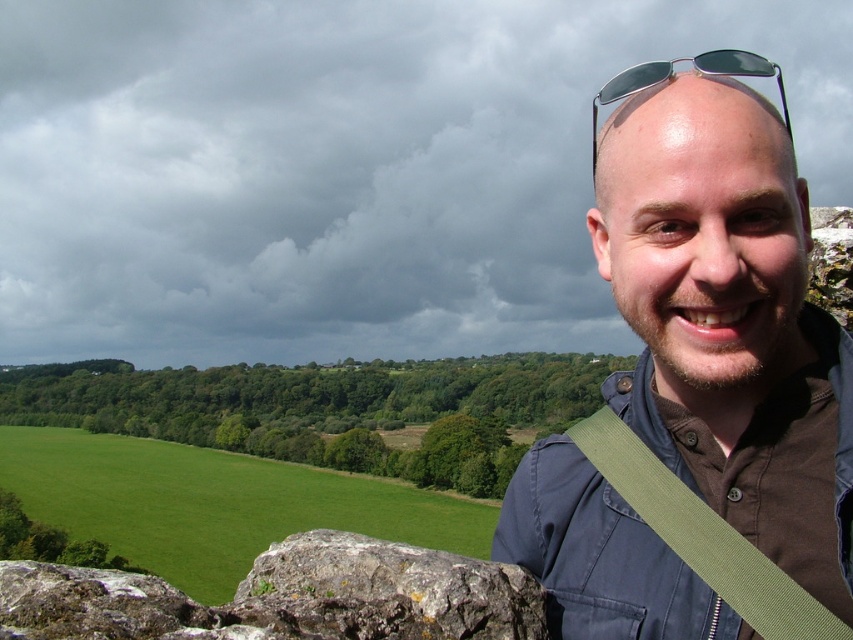
Consider the image. Is brown fabric shirt at upper right shorter than rough textured stone at lower left?

No.

Between brown fabric shirt at upper right and rough textured stone at lower left, which one appears on the left side from the viewer's perspective?

Positioned to the left is rough textured stone at lower left.

This screenshot has height=640, width=853. I want to click on brown fabric shirt at upper right, so click(699, 387).

Is point (613, 88) farther from camera compared to point (763, 61)?

Yes, it is behind point (763, 61).

Is brown fabric shirt at upper right shorter than sunglasses at upper center?

Yes, brown fabric shirt at upper right is shorter than sunglasses at upper center.

The width and height of the screenshot is (853, 640). In order to click on brown fabric shirt at upper right in this screenshot , I will do `click(699, 387)`.

Who is shorter, rough textured stone at lower left or sunglasses at upper center?

With less height is rough textured stone at lower left.

Can you confirm if rough textured stone at lower left is wider than sunglasses at upper center?

In fact, rough textured stone at lower left might be narrower than sunglasses at upper center.

Is point (252, 612) closer to camera compared to point (647, 76)?

No, it is behind (647, 76).

You are a GUI agent. You are given a task and a screenshot of the screen. Output one action in this format:
    pyautogui.click(x=<x>, y=<y>)
    Task: Click on the rough textured stone at lower left
    This screenshot has width=853, height=640.
    Given the screenshot: What is the action you would take?
    pyautogui.click(x=283, y=596)